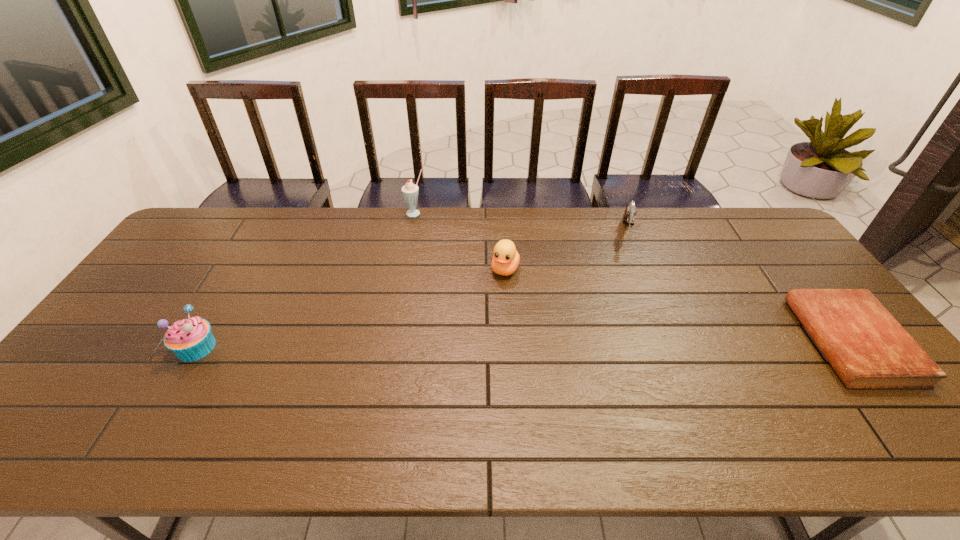
The height and width of the screenshot is (540, 960). I want to click on free area in between the third farthest object and the shortest object, so click(678, 305).

Where is `vacant space that's between the fourth object from right to left and the leftmost object`? vacant space that's between the fourth object from right to left and the leftmost object is located at coordinates (306, 280).

Identify the location of free spot between the shortest object and the tallest object. (633, 277).

Where is `free spot between the second object from right to left and the tallest object`? This screenshot has height=540, width=960. free spot between the second object from right to left and the tallest object is located at coordinates (521, 223).

This screenshot has width=960, height=540. What are the coordinates of `free point between the leftmost object and the third farthest object` in the screenshot? It's located at (351, 308).

I want to click on free space between the tallest object and the fourth object from left to right, so click(x=521, y=223).

Find the location of `vacant point located between the second object from right to left and the Bible`. vacant point located between the second object from right to left and the Bible is located at coordinates (739, 287).

This screenshot has width=960, height=540. Find the location of `blank region between the milkshake and the muffin`. blank region between the milkshake and the muffin is located at coordinates (306, 280).

At what (x,y) coordinates should I click in order to perform the action: click on free spot between the Bible and the muffin. Please return your answer as a coordinate pair (x, y). The width and height of the screenshot is (960, 540). Looking at the image, I should click on (524, 344).

The width and height of the screenshot is (960, 540). I want to click on vacant space that is in between the second object from right to left and the third farthest object, so click(x=566, y=251).